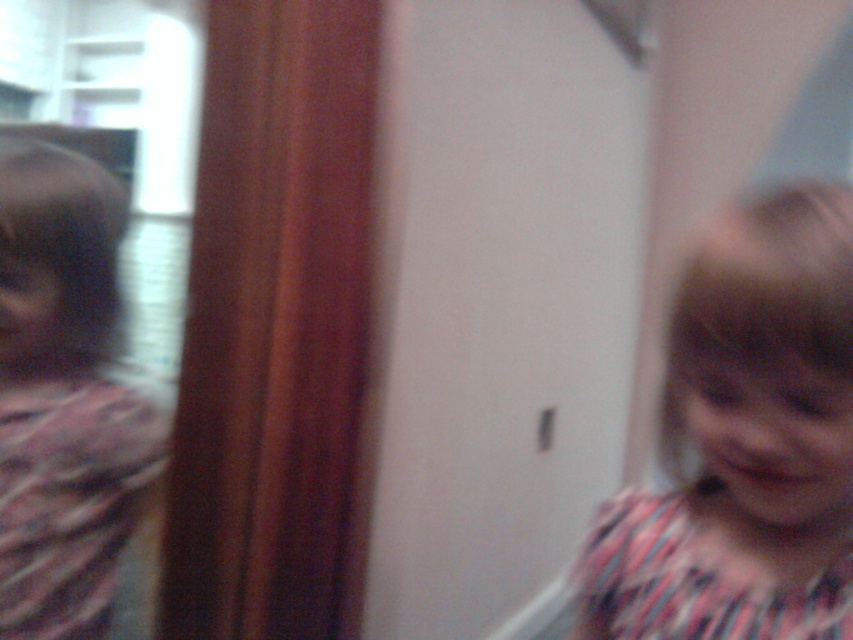
Question: Which point is closer to the camera taking this photo?

Choices:
 (A) (79, 440)
 (B) (817, 228)

Answer: (B)

Question: Is pink striped shirt at right to the right of matte pink scarf at left from the viewer's perspective?

Choices:
 (A) no
 (B) yes

Answer: (B)

Question: Which of the following is the farthest from the observer?

Choices:
 (A) (74, 572)
 (B) (589, 572)

Answer: (A)

Question: Which point is closer to the camera taking this photo?

Choices:
 (A) (621, 493)
 (B) (51, 362)

Answer: (B)

Question: Does pink striped shirt at right have a greater width compared to matte pink scarf at left?

Choices:
 (A) no
 (B) yes

Answer: (B)

Question: Where is pink striped shirt at right located in relation to matte pink scarf at left in the image?

Choices:
 (A) right
 (B) left

Answer: (A)